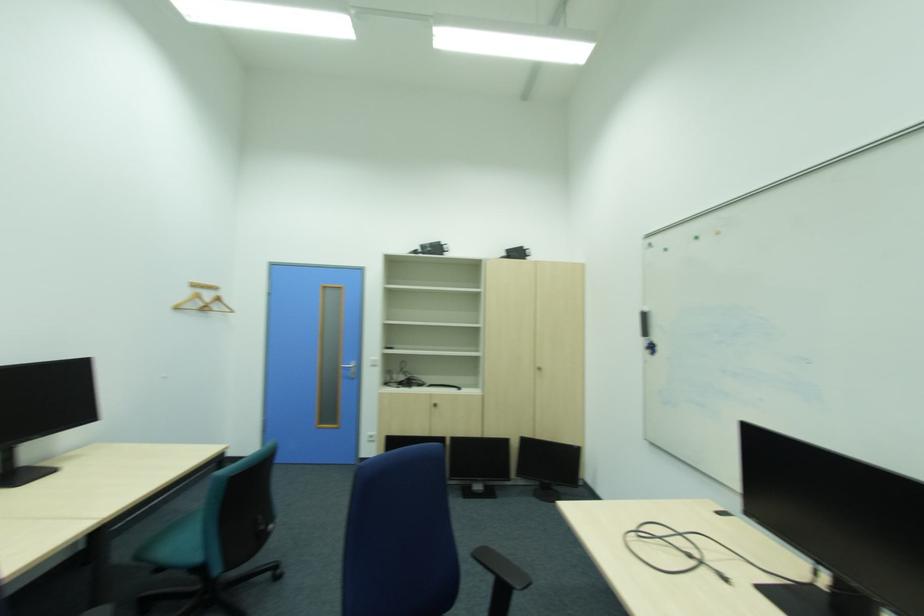
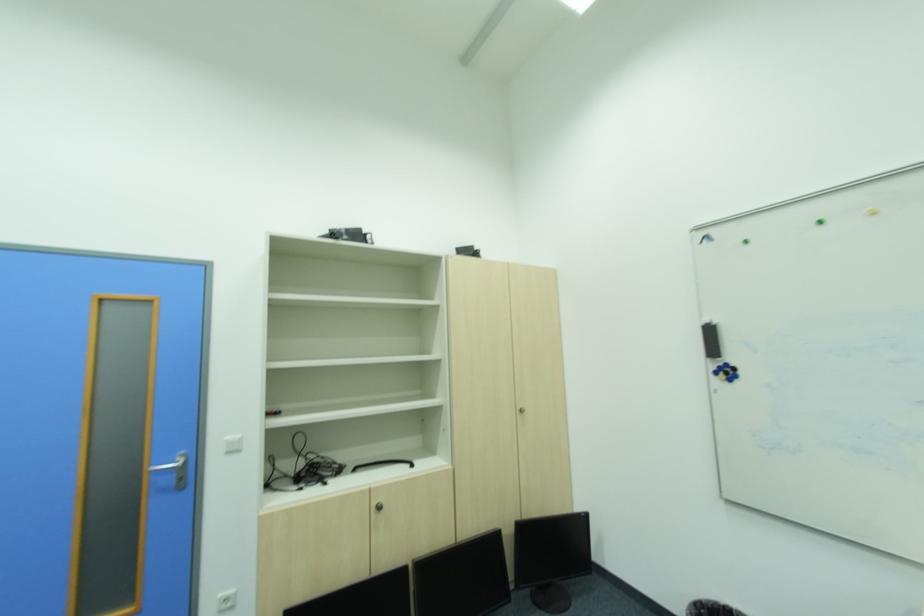
In the second image, find the point that corresponds to [530,442] in the first image.

(531, 531)